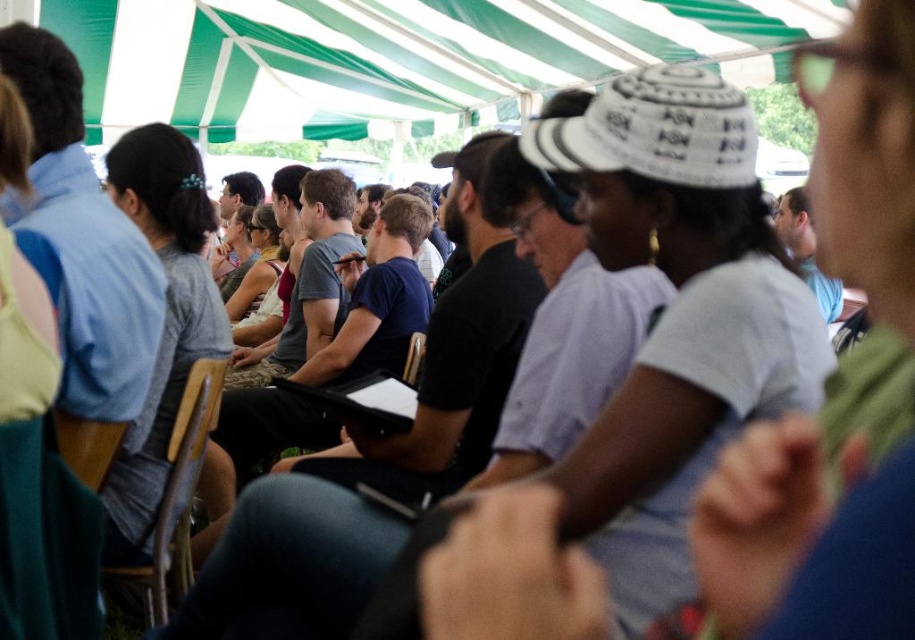
Based on the photo, you are standing at the origin point of the coordinate system, which is the bottom left corner of the image. You need to locate the wooden chair at center. What are its coordinates?

The wooden chair at center is located at coordinates point (175, 497).